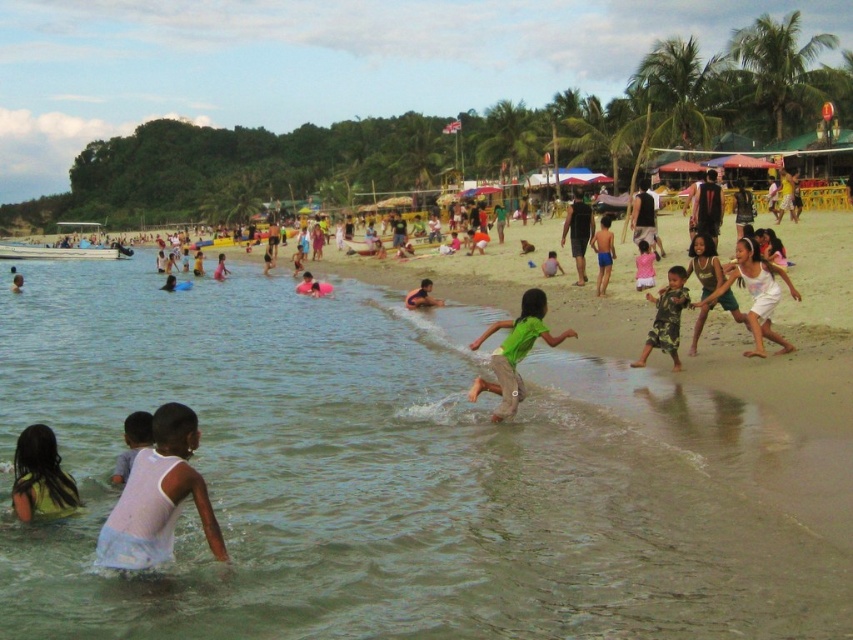
You are a photographer standing at the center of the beach. You want to take a photo of the white cotton tank top at lower left located at point (158, 497). Which direction should you move to get a better shot?

The photographer should move to the right to get a better shot of the white cotton tank top at lower left located at point (158, 497).

From the picture: You are a photographer trying to capture a group photo of the two people wearing the green matte shirt at center and the white cotton dress at center. If your camera frame can only accommodate one of them fully, which one should you focus on to ensure they fit within the frame?

The green matte shirt at center might be wider than the white cotton dress at center, so focusing on the green matte shirt at center would be better to ensure it fits within the frame.